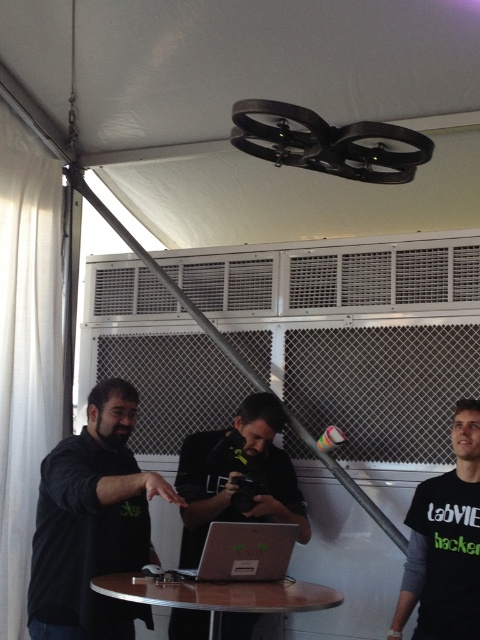
You are standing at the center of the image. Where is the black matte shirt at lower right located relative to you?

The black matte shirt at lower right is located at the lower right of the image, which would be to your bottom right direction from your central position.

Based on the photo, you are standing at the entrance of the tent and want to approach the person wearing the black matte shirt at left. Which direction should you move to reach them?

The black matte shirt at left is located at point (93, 524), so you should move towards the left side of the tent to reach them.

What is located at the point with coordinates (445, 541) in the image?

The black matte shirt at lower right is located at point (445, 541).